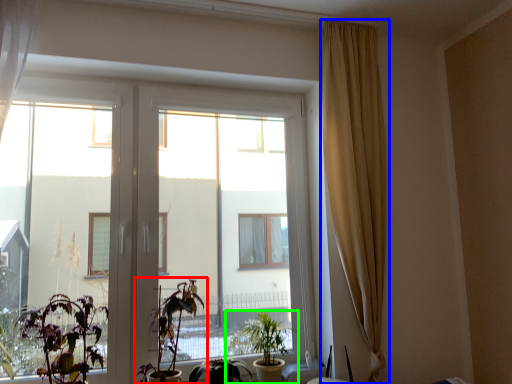
Question: Based on their relative distances, which object is nearer to houseplant (highlighted by a red box)? Choose from curtain (highlighted by a blue box) and houseplant (highlighted by a green box).

Choices:
 (A) curtain
 (B) houseplant

Answer: (B)